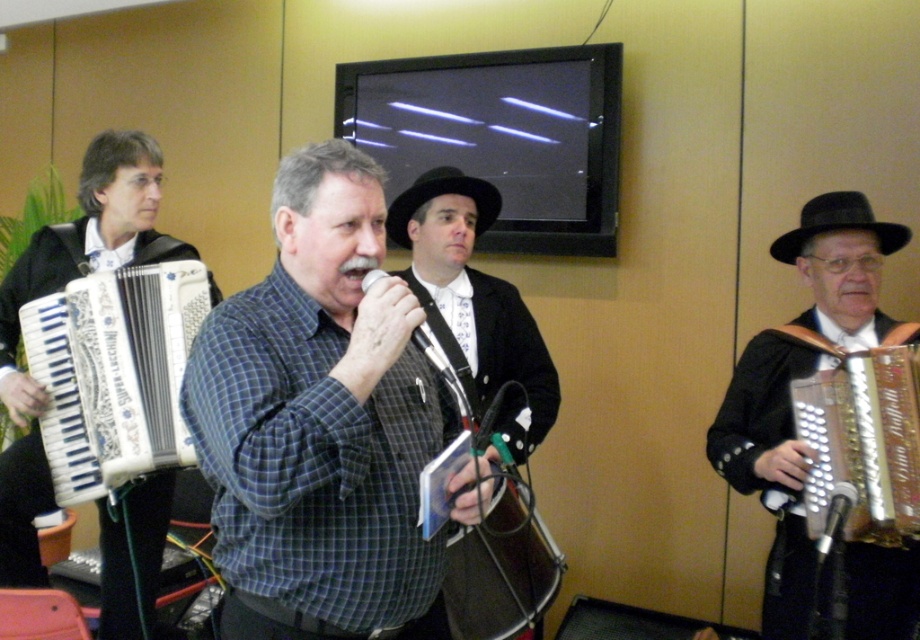
Who is more distant from viewer, (105, 474) or (915, 525)?

The point (105, 474) is behind.

Who is taller, white plastic accordion at left or metallic gold accordion at right?

white plastic accordion at left is taller.

Is point (125, 412) closer to viewer compared to point (797, 403)?

No, (125, 412) is behind (797, 403).

Where is `white plastic accordion at left`? The image size is (920, 640). white plastic accordion at left is located at coordinates [115, 372].

Is shiny gold accordion at right smaller than metallic gold accordion at right?

Actually, shiny gold accordion at right might be larger than metallic gold accordion at right.

Is shiny gold accordion at right taller than metallic gold accordion at right?

Yes.

Does point (872, 554) lie in front of point (882, 486)?

No, (872, 554) is behind (882, 486).

Locate an element on the screen. This screenshot has width=920, height=640. shiny gold accordion at right is located at coordinates (801, 378).

Which is more to the left, plaid shirt at center or white matte accordion at left?

Positioned to the left is white matte accordion at left.

Does plaid shirt at center appear under white matte accordion at left?

Yes, plaid shirt at center is below white matte accordion at left.

Between point (469, 342) and point (101, 262), which one is positioned behind?

Positioned behind is point (101, 262).

This screenshot has height=640, width=920. Find the location of `plaid shirt at center`. plaid shirt at center is located at coordinates (474, 305).